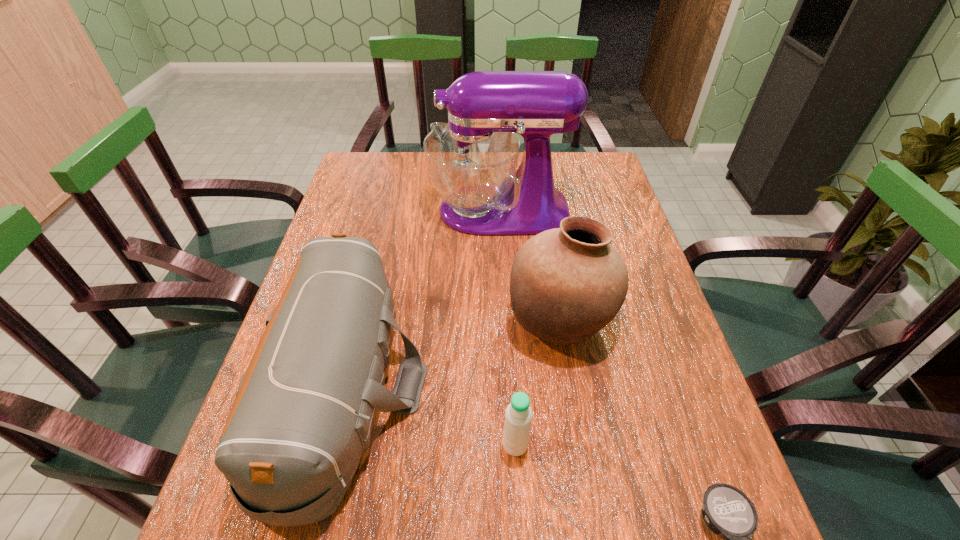
At what (x,y) coordinates should I click in order to perform the action: click on vacant region located on the left of the second shortest object. Please return your answer as a coordinate pair (x, y). This screenshot has height=540, width=960. Looking at the image, I should click on (470, 445).

Locate an element on the screen. object at the far edge is located at coordinates (472, 161).

You are a GUI agent. You are given a task and a screenshot of the screen. Output one action in this format:
    pyautogui.click(x=<x>, y=<y>)
    Task: Click on the object at the near edge
    The width and height of the screenshot is (960, 540).
    Given the screenshot: What is the action you would take?
    pyautogui.click(x=303, y=414)

Where is `object located in the left edge section of the desktop`? The image size is (960, 540). object located in the left edge section of the desktop is located at coordinates (303, 414).

The height and width of the screenshot is (540, 960). Find the location of `object that is at the right edge`. object that is at the right edge is located at coordinates click(566, 284).

Identify the location of object at the near left corner. The height and width of the screenshot is (540, 960). (303, 414).

Find the location of a particular element. The image size is (960, 540). vacant space at the far edge of the desktop is located at coordinates tap(558, 183).

Find the location of a particular element. vacant space at the right edge is located at coordinates (626, 402).

In order to click on empty space between the farthest object and the water bottle in this screenshot , I will do `click(507, 328)`.

The width and height of the screenshot is (960, 540). Identify the location of vacant area between the duffel bag and the fourth shortest object. (453, 354).